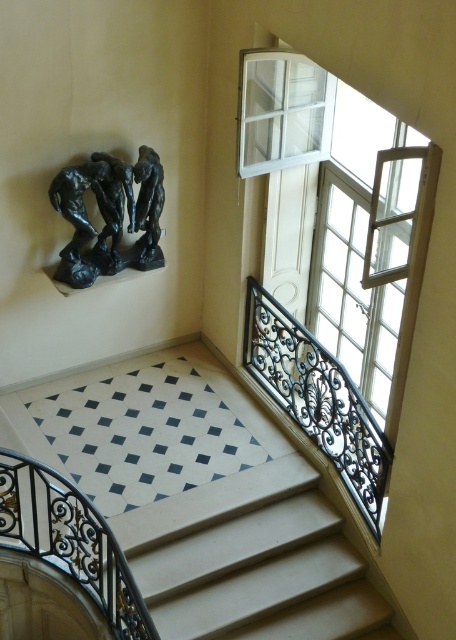
Question: Which object is closer to the camera taking this photo?

Choices:
 (A) white glass window at upper right
 (B) black wrought iron balustrade at lower left

Answer: (B)

Question: Is clear glass window at upper right to the left of black wrought iron balustrade at lower left from the viewer's perspective?

Choices:
 (A) no
 (B) yes

Answer: (A)

Question: Is bronze sculpture at upper left closer to the viewer compared to bronze statue at upper left?

Choices:
 (A) yes
 (B) no

Answer: (A)

Question: Observing the image, what is the correct spatial positioning of bronze sculpture at upper left in reference to white glass window at upper right?

Choices:
 (A) above
 (B) below

Answer: (B)

Question: Which point appears farthest from the camera in this image?

Choices:
 (A) (25, 502)
 (B) (262, 381)
 (C) (324, 113)

Answer: (B)

Question: Which point is farther from the camera taking this photo?

Choices:
 (A) (65, 179)
 (B) (156, 154)
 (C) (99, 547)

Answer: (B)